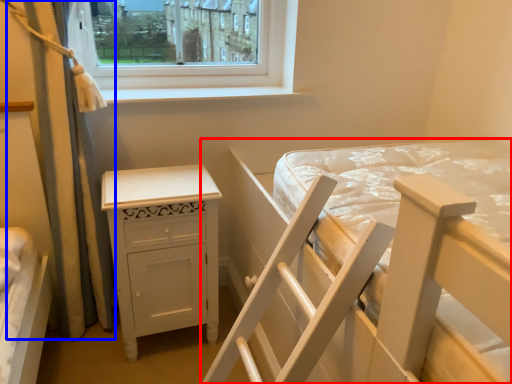
Question: Which point is further to the camera, bed (highlighted by a red box) or curtain (highlighted by a blue box)?

Choices:
 (A) bed
 (B) curtain

Answer: (B)